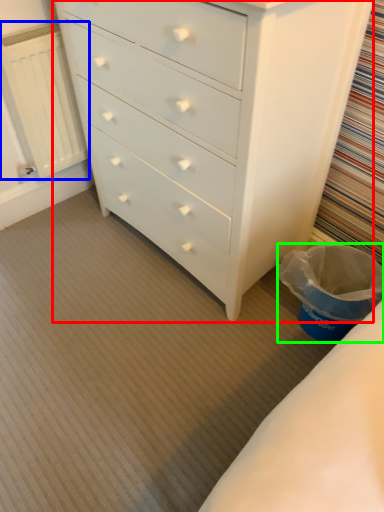
Question: Based on their relative distances, which object is nearer to chest of drawers (highlighted by a red box)? Choose from radiator (highlighted by a blue box) and laundry basket (highlighted by a green box).

Choices:
 (A) radiator
 (B) laundry basket

Answer: (B)